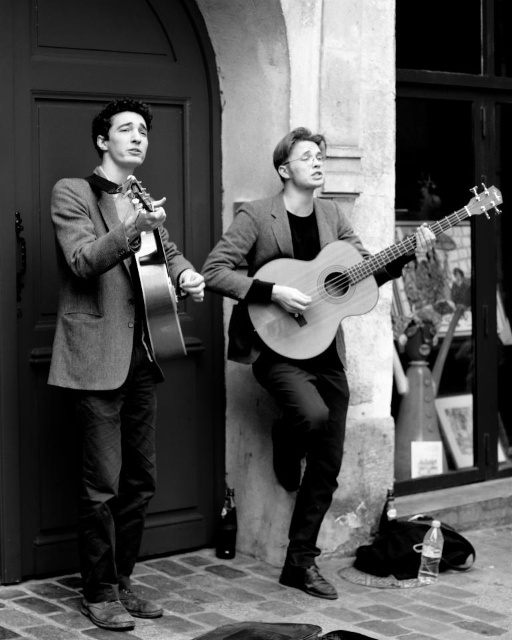
You are standing at the street corner where the two musicians are performing. You want to place a small donation box between the two points marked as point (x=125, y=348) and point (x=156, y=360). Which point should the donation box be closer to in order to be more visible to people passing by?

The donation box should be placed closer to point (x=125, y=348) because it is closer to the viewer than point (x=156, y=360), making it more visible.

From the picture: You are a music enthusiast who wants to know which guitar is taller between the wooden acoustic guitar at center and the matte acoustic guitar at center. Based on the scene description, which one is taller?

The wooden acoustic guitar at center is much taller than the matte acoustic guitar at center.